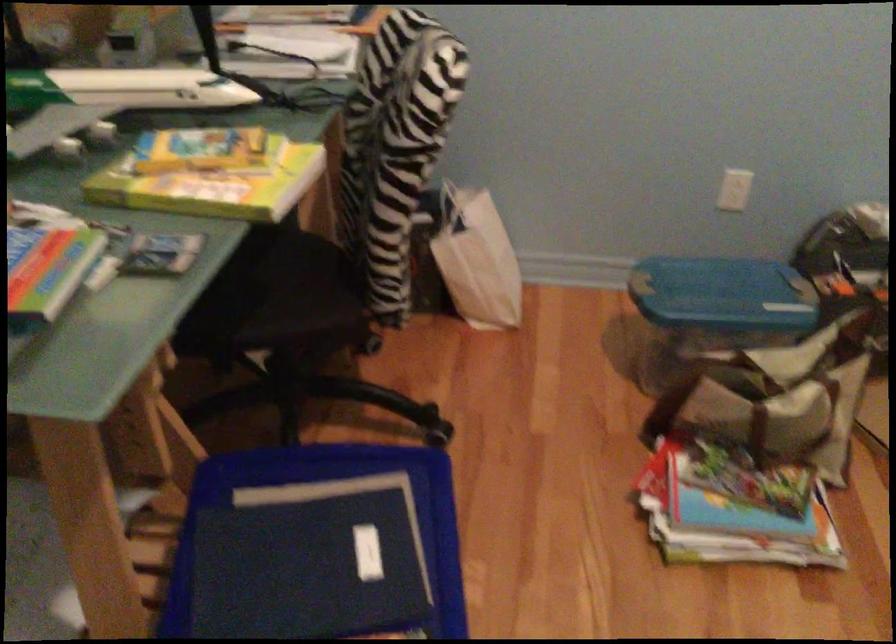
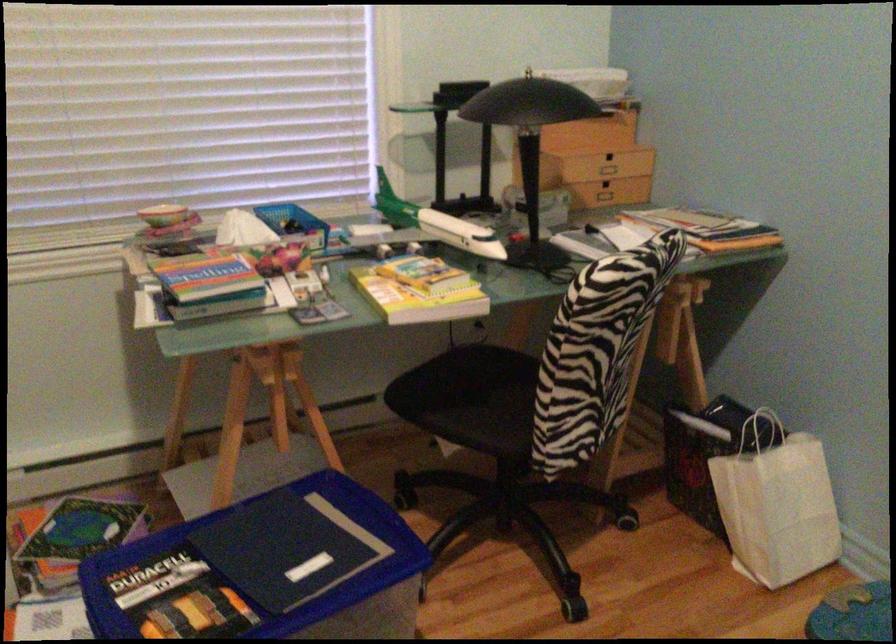
Find the pixel in the second image that matches (112,91) in the first image.

(438, 225)